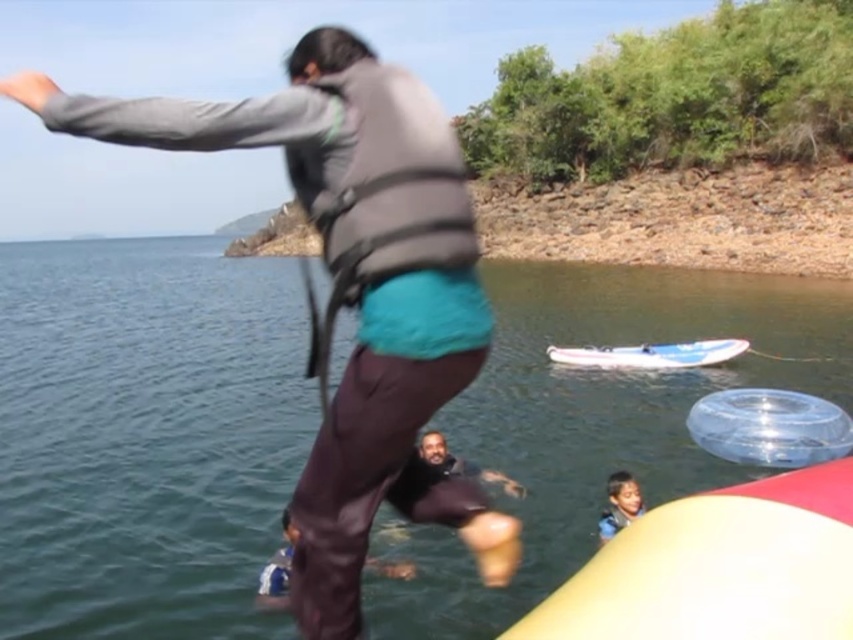
Question: Can you confirm if clear blue water at center is positioned to the right of white plastic boat at center?

Choices:
 (A) yes
 (B) no

Answer: (B)

Question: Based on their relative distances, which object is nearer to the clear blue water at center?

Choices:
 (A) white plastic boat at center
 (B) smooth skin child at lower right

Answer: (B)

Question: Does clear blue water at center have a smaller size compared to white plastic boat at center?

Choices:
 (A) no
 (B) yes

Answer: (A)

Question: Does clear blue water at center have a greater width compared to white plastic boat at center?

Choices:
 (A) no
 (B) yes

Answer: (B)

Question: Which object is the farthest from the white plastic boat at center?

Choices:
 (A) smooth skin child at lower right
 (B) yellow rubber boat at lower right
 (C) matte gray life vest at center
 (D) clear blue water at center

Answer: (B)

Question: Which point is closer to the camera?

Choices:
 (A) clear blue water at center
 (B) white plastic boat at center
 (C) yellow rubber boat at lower right

Answer: (C)